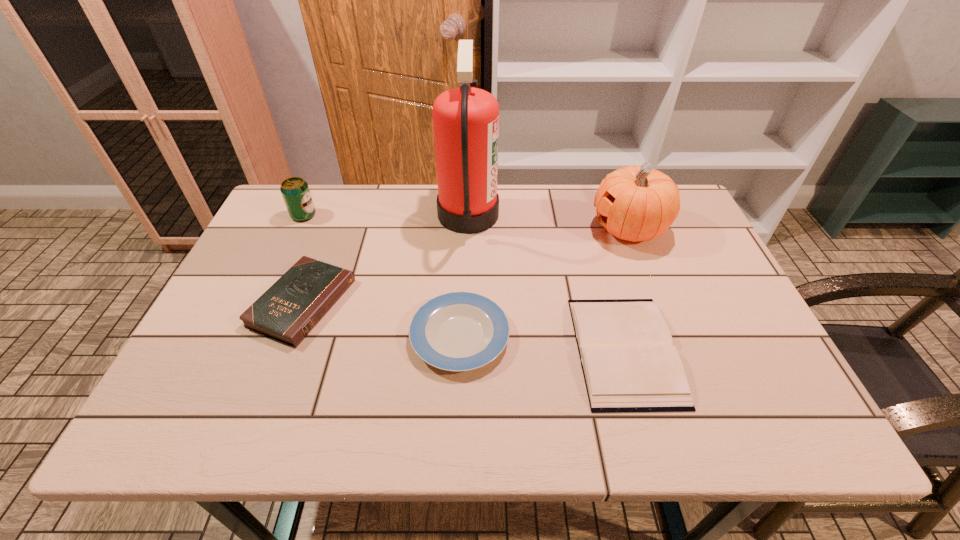
At what (x,y) coordinates should I click in order to perform the action: click on object at the right edge. Please return your answer as a coordinate pair (x, y). Looking at the image, I should click on pyautogui.click(x=636, y=203).

Image resolution: width=960 pixels, height=540 pixels. Identify the location of object at the far left corner. (295, 191).

The height and width of the screenshot is (540, 960). I want to click on object located in the far right corner section of the desktop, so [636, 203].

You are a GUI agent. You are given a task and a screenshot of the screen. Output one action in this format:
    pyautogui.click(x=<x>, y=<y>)
    Task: Click on the vacant space at the far edge
    
    Given the screenshot: What is the action you would take?
    pyautogui.click(x=396, y=221)

This screenshot has height=540, width=960. Find the location of `vacant area at the near edge`. vacant area at the near edge is located at coordinates (368, 408).

In the image, there is a desktop. Where is `vacant space at the left edge`? This screenshot has width=960, height=540. vacant space at the left edge is located at coordinates (275, 266).

At what (x,y) coordinates should I click in order to perform the action: click on vacant space at the right edge of the desktop. Please return your answer as a coordinate pair (x, y). Looking at the image, I should click on (765, 368).

This screenshot has width=960, height=540. I want to click on vacant region at the near left corner, so click(204, 412).

In order to click on free space at the far right corner of the desktop in this screenshot , I will do `click(688, 220)`.

This screenshot has width=960, height=540. In the image, there is a desktop. Identify the location of free space at the near right corner. (804, 420).